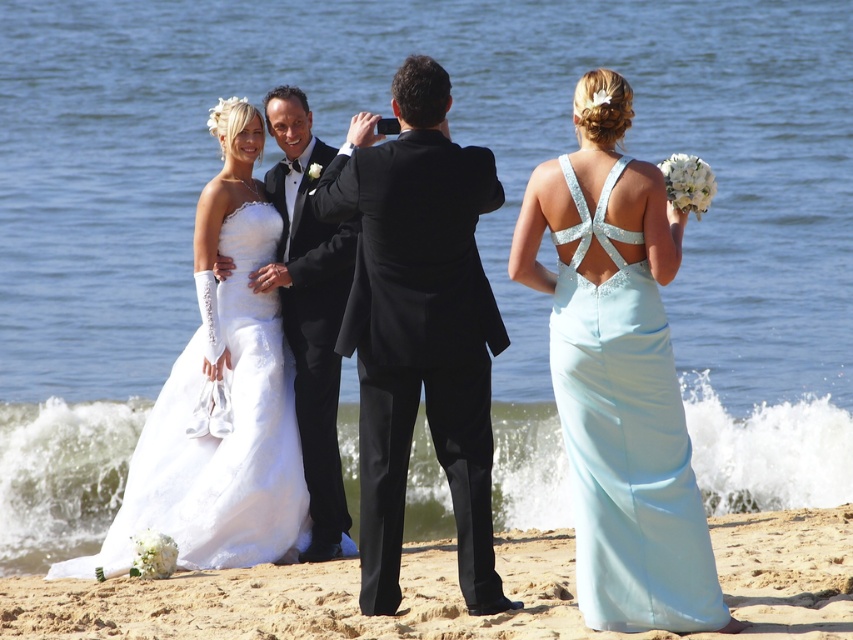
Is light blue satin dress at right taller than black satin tuxedo at center?

Yes, light blue satin dress at right is taller than black satin tuxedo at center.

The width and height of the screenshot is (853, 640). In order to click on light blue satin dress at right in this screenshot , I will do `click(619, 374)`.

Is point (560, 170) behind point (311, 294)?

No.

I want to click on light blue satin dress at right, so click(x=619, y=374).

Who is higher up, light blue satin dress at right or sandy beach at lower center?

light blue satin dress at right

Who is more forward, (x=656, y=371) or (x=148, y=600)?

Point (x=656, y=371) is in front.

This screenshot has width=853, height=640. In order to click on light blue satin dress at right in this screenshot , I will do (619, 374).

Can you confirm if sandy beach at lower center is taller than black satin tuxedo at center?

Incorrect, sandy beach at lower center's height is not larger of black satin tuxedo at center's.

Consider the image. Between sandy beach at lower center and black satin tuxedo at center, which one is positioned lower?

sandy beach at lower center is below.

At what (x,y) coordinates should I click in order to perform the action: click on sandy beach at lower center. Please return your answer as a coordinate pair (x, y). Looking at the image, I should click on [309, 600].